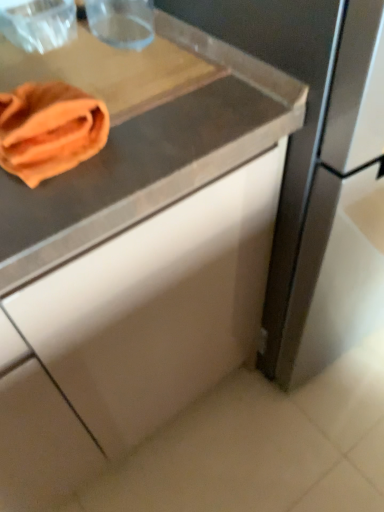
Identify the location of free spot to the right of orange microfiber cloth at upper left. (162, 122).